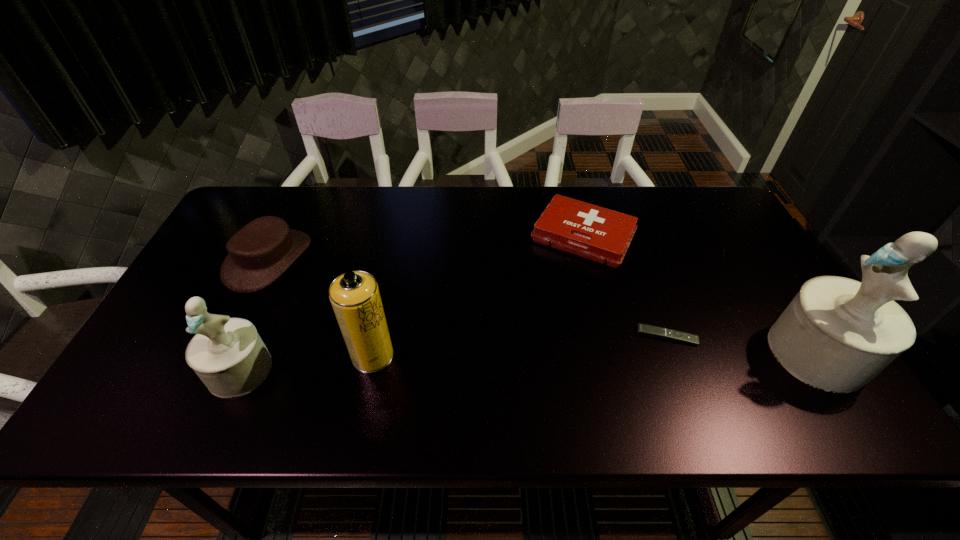
To achieve uniform spacing by inserting another figurine among them, please point to a free space for this new figurine. Please provide its 2D coordinates. Your answer should be formatted as a tuple, i.e. [(x, y)], where the tuple contains the x and y coordinates of a point satisfying the conditions above.

[(534, 361)]